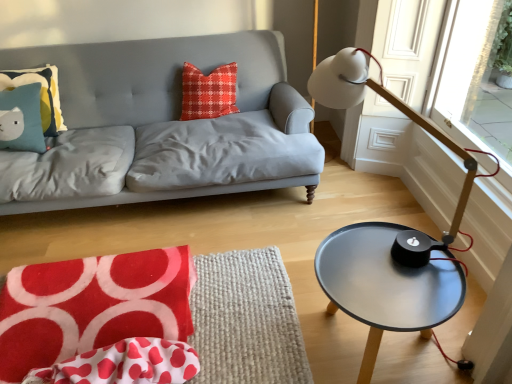
Locate an element on the screen. blank area beneath metallic gray table at right (from a real-world perspective) is located at coordinates (x=362, y=344).